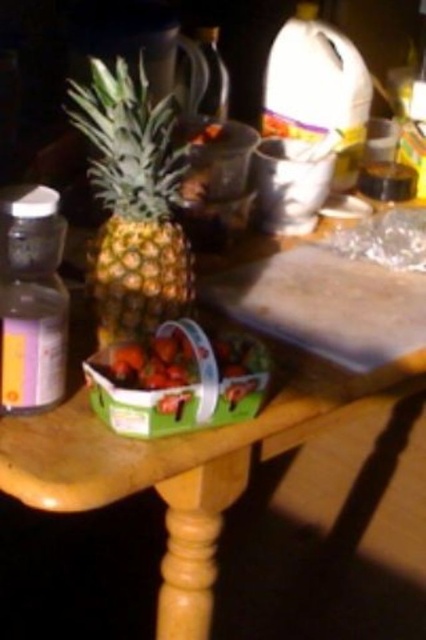
Question: Which point is farther to the camera?

Choices:
 (A) green textured pineapple at center
 (B) wooden table at center

Answer: (A)

Question: Is wooden table at center above green textured pineapple at center?

Choices:
 (A) no
 (B) yes

Answer: (A)

Question: Can you confirm if wooden table at center is smaller than green textured pineapple at center?

Choices:
 (A) no
 (B) yes

Answer: (A)

Question: Among these objects, which one is farthest from the camera?

Choices:
 (A) green textured pineapple at center
 (B) wooden table at center

Answer: (A)

Question: Which point is farther from the camera taking this photo?

Choices:
 (A) (143, 218)
 (B) (190, 484)

Answer: (A)

Question: Is wooden table at center below green textured pineapple at center?

Choices:
 (A) no
 (B) yes

Answer: (B)